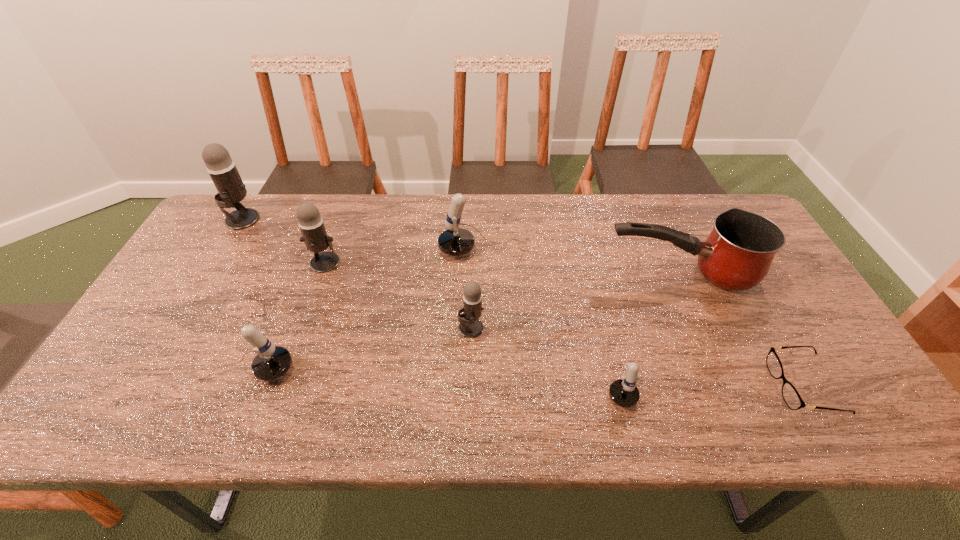
Find the location of a particular element. the rightmost white microphone is located at coordinates (623, 392).

At what (x,y) coordinates should I click in order to perform the action: click on the shortest microphone. Please return your answer as a coordinate pair (x, y). Looking at the image, I should click on (623, 392).

Find the location of a particular element. the shortest object is located at coordinates (793, 400).

Identify the location of vacant space located on the front of the leftmost microphone. The height and width of the screenshot is (540, 960). (x=222, y=254).

Locate an element on the screen. free space located 0.280m on the left of the second smallest gray microphone is located at coordinates (215, 262).

Where is `vacant space situated 0.260m on the right of the second white microphone from right to left`? The width and height of the screenshot is (960, 540). vacant space situated 0.260m on the right of the second white microphone from right to left is located at coordinates (612, 250).

Image resolution: width=960 pixels, height=540 pixels. I want to click on free space located 0.270m on the handle side of the saucepan, so pos(508,274).

Image resolution: width=960 pixels, height=540 pixels. Find the location of `vacant space situated 0.390m on the handle side of the saucepan`. vacant space situated 0.390m on the handle side of the saucepan is located at coordinates (467, 274).

The width and height of the screenshot is (960, 540). I want to click on vacant space located on the handle side of the saucepan, so click(501, 274).

Locate an element on the screen. vacant space located on the right of the second smallest white microphone is located at coordinates (458, 370).